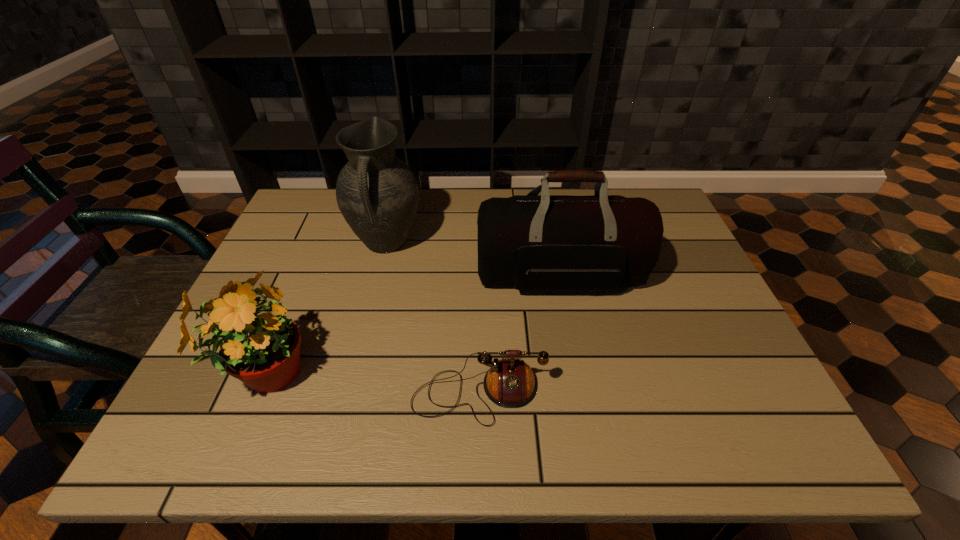
Locate an element on the screen. The image size is (960, 540). the third closest object to the telephone is located at coordinates (377, 193).